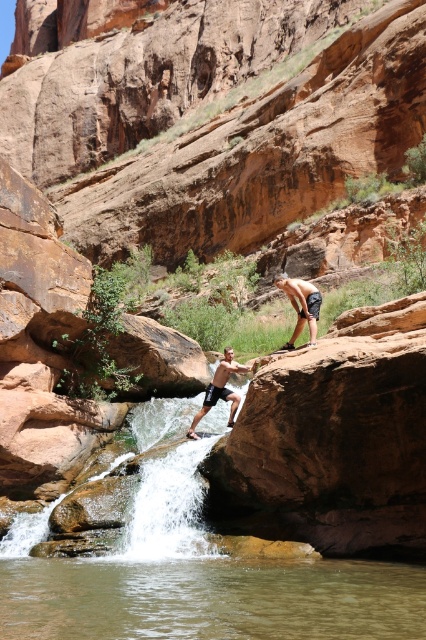
Who is positioned more to the right, clear water at center or dark blue shorts at center?

dark blue shorts at center

Does point (121, 580) lie behind point (305, 305)?

No, (121, 580) is closer to viewer.

Where is `clear water at center`? The height and width of the screenshot is (640, 426). clear water at center is located at coordinates (210, 600).

Find the location of a particular element. The image size is (426, 640). clear water at center is located at coordinates tap(210, 600).

Is the position of dark blue shorts at center more distant than that of matte black shorts at center?

No, it is in front of matte black shorts at center.

Is point (298, 291) closer to camera compared to point (213, 388)?

Yes, it is in front of point (213, 388).

In order to click on dark blue shorts at center in this screenshot , I will do `click(301, 305)`.

What do you see at coordinates (210, 600) in the screenshot?
I see `clear water at center` at bounding box center [210, 600].

Between clear water at center and matte black shorts at center, which one appears on the right side from the viewer's perspective?

Answer: From the viewer's perspective, matte black shorts at center appears more on the right side.

You are a GUI agent. You are given a task and a screenshot of the screen. Output one action in this format:
    pyautogui.click(x=<x>, y=<y>)
    Task: Click on the clear water at center
    This screenshot has height=640, width=426.
    Given the screenshot: What is the action you would take?
    pyautogui.click(x=210, y=600)

I want to click on clear water at center, so click(x=210, y=600).